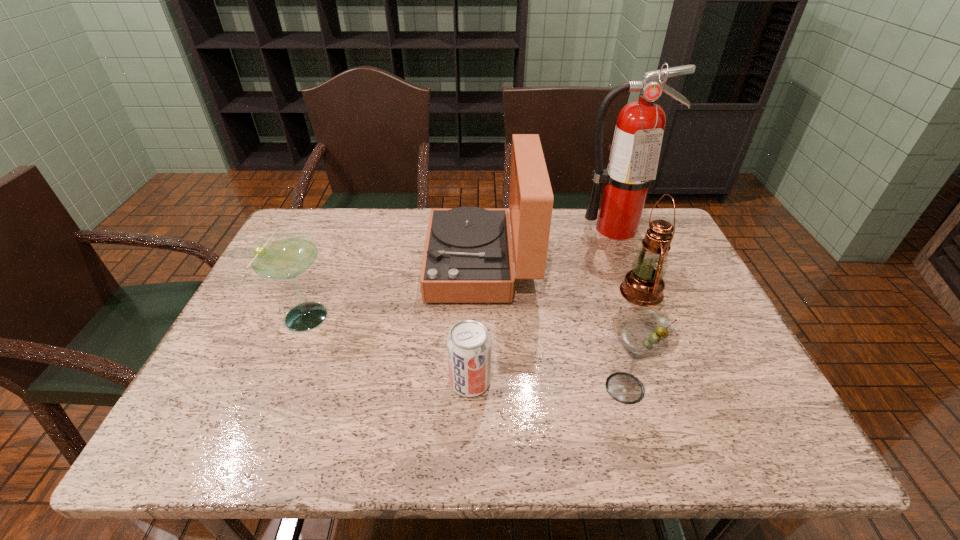
Where is `vacant space located on the face of the phonograph record`? The image size is (960, 540). vacant space located on the face of the phonograph record is located at coordinates (286, 265).

Find the location of a particular element. This screenshot has width=960, height=540. vacant space located 0.050m on the right of the oil lamp is located at coordinates (682, 292).

Identify the location of free region located on the back of the leftmost object. (332, 252).

You are a GUI agent. You are given a task and a screenshot of the screen. Output one action in this format:
    pyautogui.click(x=<x>, y=<y>)
    Task: Click on the free region located on the back of the nearer martini
    
    Given the screenshot: What is the action you would take?
    pyautogui.click(x=592, y=274)

The width and height of the screenshot is (960, 540). In order to click on vacant area located 0.110m on the front of the soda can in this screenshot , I will do `click(468, 450)`.

This screenshot has width=960, height=540. What are the coordinates of `fire extinguisher that is at the far edge` in the screenshot? It's located at tap(635, 151).

I want to click on phonograph record that is at the far edge, so click(467, 258).

Find the location of a particular element. The height and width of the screenshot is (540, 960). object present at the near edge is located at coordinates (643, 333).

This screenshot has width=960, height=540. In order to click on object at the left edge in this screenshot , I will do `click(284, 255)`.

This screenshot has width=960, height=540. In order to click on fire extinguisher at the right edge in this screenshot , I will do `click(635, 151)`.